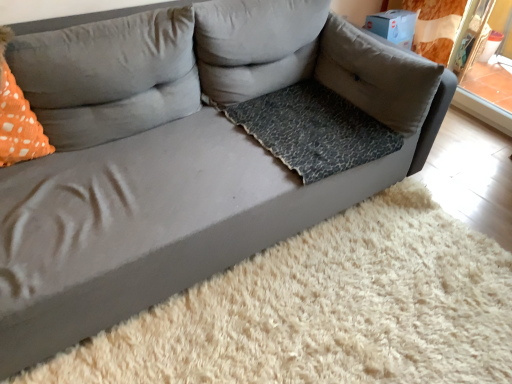
Question: Is gray fabric pillow at center, which is the second pillow in right-to-left order, located within gray fabric pillow at upper right, the first pillow in the right-to-left sequence?

Choices:
 (A) yes
 (B) no

Answer: (B)

Question: Can you confirm if gray fabric pillow at upper right, the third pillow viewed from the left, is smaller than gray fabric pillow at center, which is the 2th pillow in left-to-right order?

Choices:
 (A) yes
 (B) no

Answer: (A)

Question: From the image's perspective, is gray fabric pillow at upper right, the first pillow in the right-to-left sequence, above gray fabric pillow at center, which is the 2th pillow in left-to-right order?

Choices:
 (A) yes
 (B) no

Answer: (B)

Question: Is gray fabric pillow at upper right, the first pillow in the right-to-left sequence, at the left side of gray fabric pillow at center, which is the second pillow in right-to-left order?

Choices:
 (A) no
 (B) yes

Answer: (A)

Question: Is gray fabric pillow at upper right, the third pillow viewed from the left, completely or partially outside of gray fabric pillow at center, which is the 2th pillow in left-to-right order?

Choices:
 (A) yes
 (B) no

Answer: (A)

Question: In the image, is leopard print fabric dog bed at center on the left side or the right side of orange dotted fabric at left?

Choices:
 (A) left
 (B) right

Answer: (B)

Question: Considering the positions of leopard print fabric dog bed at center and orange dotted fabric at left in the image, is leopard print fabric dog bed at center taller or shorter than orange dotted fabric at left?

Choices:
 (A) short
 (B) tall

Answer: (A)

Question: From a real-world perspective, is leopard print fabric dog bed at center above or below orange dotted fabric at left?

Choices:
 (A) below
 (B) above

Answer: (A)

Question: From the image's perspective, relative to orange dotted fabric at left, is leopard print fabric dog bed at center above or below?

Choices:
 (A) above
 (B) below

Answer: (B)

Question: Visually, is orange dotted pillow at left, acting as the 3th pillow starting from the right, positioned to the left or to the right of leopard print fabric dog bed at center?

Choices:
 (A) left
 (B) right

Answer: (A)

Question: Which is correct: orange dotted pillow at left, the first pillow from the left, is inside leopard print fabric dog bed at center, or outside of it?

Choices:
 (A) inside
 (B) outside

Answer: (B)

Question: From the image's perspective, relative to leopard print fabric dog bed at center, is orange dotted pillow at left, the first pillow from the left, above or below?

Choices:
 (A) below
 (B) above

Answer: (B)

Question: Considering the positions of orange dotted pillow at left, acting as the 3th pillow starting from the right, and leopard print fabric dog bed at center in the image, is orange dotted pillow at left, acting as the 3th pillow starting from the right, taller or shorter than leopard print fabric dog bed at center?

Choices:
 (A) short
 (B) tall

Answer: (B)

Question: In the image, is orange dotted pillow at left, the first pillow from the left, on the left side or the right side of orange dotted fabric at left?

Choices:
 (A) right
 (B) left

Answer: (A)

Question: In terms of height, does orange dotted pillow at left, acting as the 3th pillow starting from the right, look taller or shorter compared to orange dotted fabric at left?

Choices:
 (A) short
 (B) tall

Answer: (A)